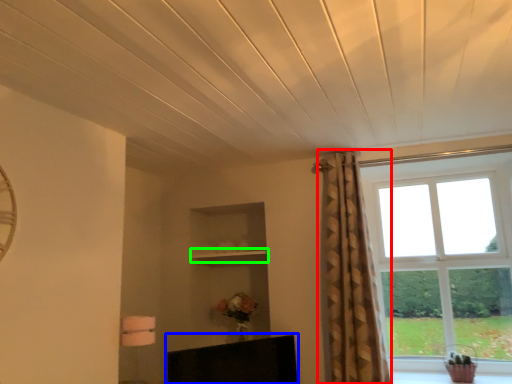
Question: Which object is positioned farthest from curtain (highlighted by a red box)? Select from furniture (highlighted by a blue box) and shelf (highlighted by a green box).

Choices:
 (A) furniture
 (B) shelf

Answer: (B)